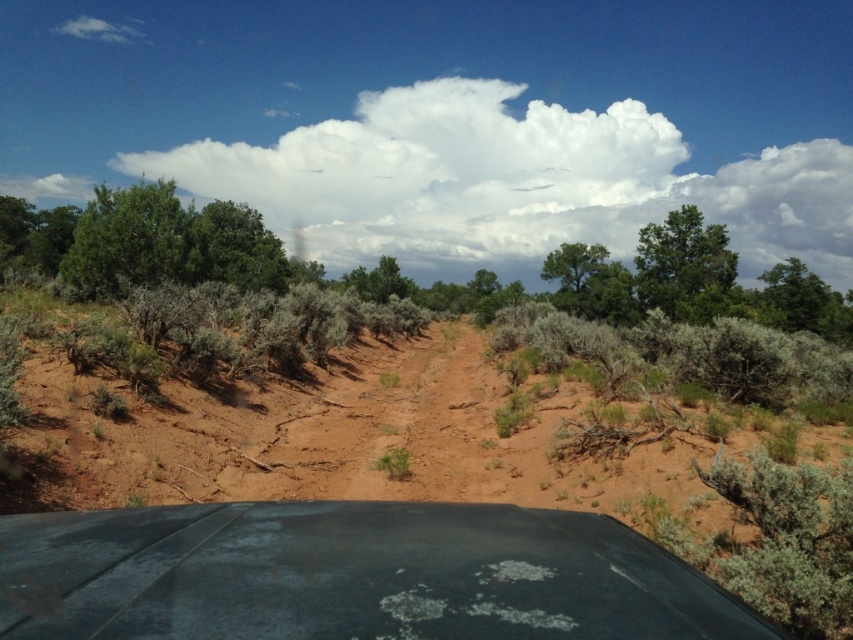
You are inside the vehicle and want to know the exact coordinates of the matte black windshield at center. What are its coordinates?

The matte black windshield at center is located at coordinates point (351, 576).